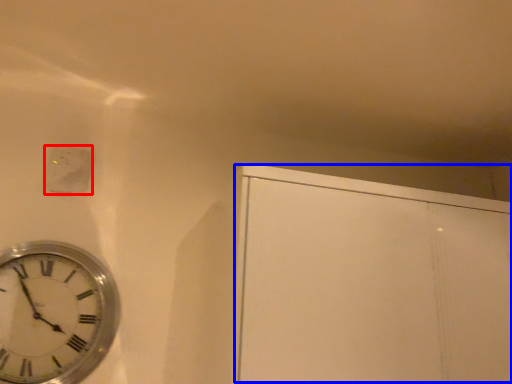
Question: Which point is further to the camera, electric outlet (highlighted by a red box) or glass door (highlighted by a blue box)?

Choices:
 (A) electric outlet
 (B) glass door

Answer: (A)